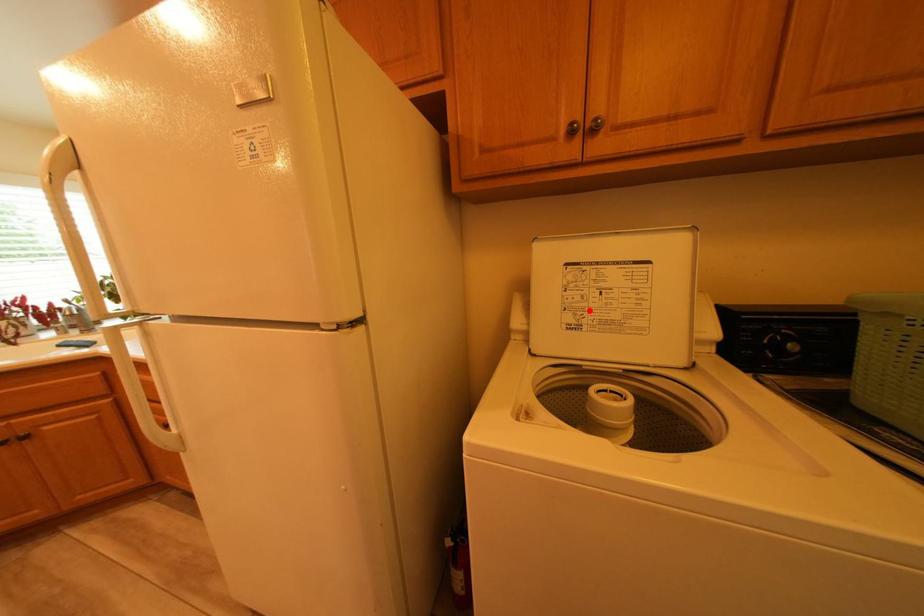
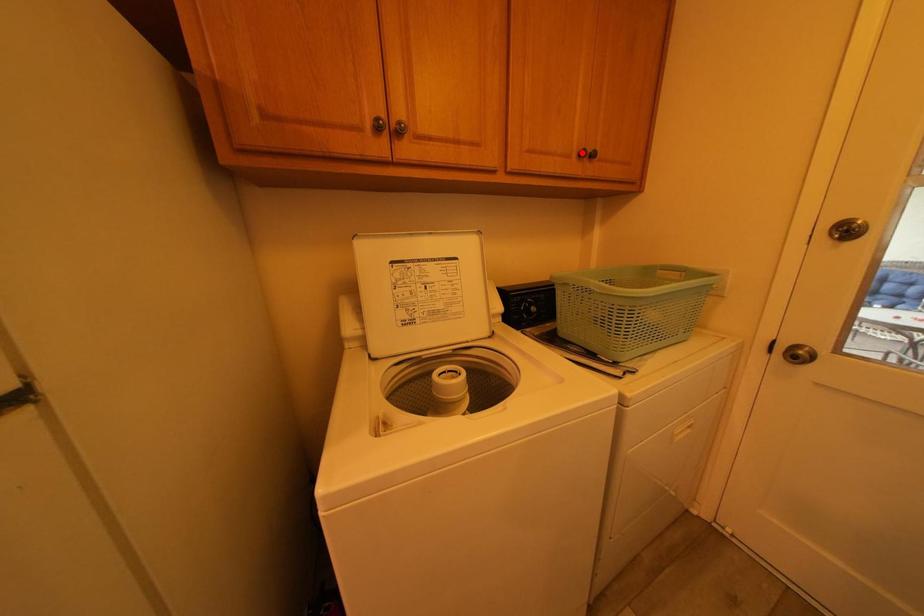
I am providing you with two images of the same scene from different viewpoints. A red point is marked on the first image and another point is marked on the second image. Are the points marked in image1 and image2 representing the same 3D position?

No